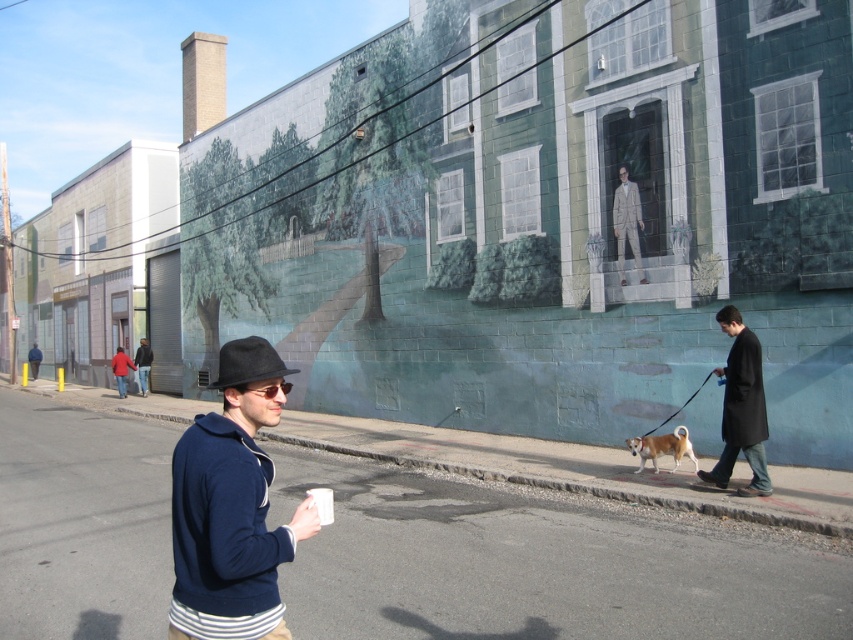
You are a tailor observing the street scene. You need to determine which clothing item is shorter in height between the black wool coat at right and the dark blue sweater at center. Can you identify the shorter one?

The black wool coat at right is not as tall as the dark blue sweater at center, so the black wool coat at right is shorter in height.

Consider the image. You are a fashion designer observing a street scene with two people wearing light beige suit at center and dark blue sweater at center. Which one is positioned to the right?

The light beige suit at center is positioned to the right of the dark blue sweater at center.

You are a fashion designer observing the street scene. You notice two people wearing the black wool coat at right and the dark blue sweater at center. Which clothing item is positioned higher in the image?

The black wool coat at right is located above the dark blue sweater at center, so the black wool coat at right is positioned higher in the image.